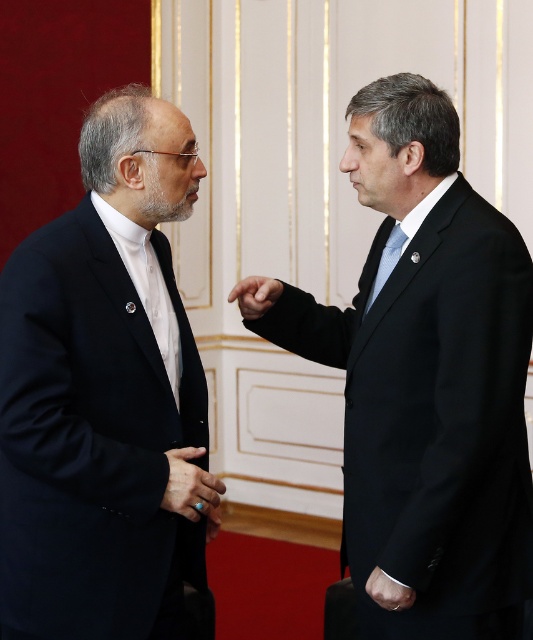
Question: Does smooth skin hand at center have a smaller size compared to blue silk tie at right?

Choices:
 (A) yes
 (B) no

Answer: (B)

Question: Is matte black suit at left behind matte black hand at center?

Choices:
 (A) yes
 (B) no

Answer: (B)

Question: Which point is closer to the camera?

Choices:
 (A) blue silk tie at right
 (B) matte black suit at left
 (C) matte black hand at center
 (D) black matte suit at right

Answer: (B)

Question: Does matte black hand at center have a smaller size compared to smooth skin hand at center?

Choices:
 (A) yes
 (B) no

Answer: (B)

Question: Which object is the farthest from the black matte suit at right?

Choices:
 (A) smooth skin hand at center
 (B) leather glove at lower right
 (C) matte black suit at left
 (D) matte black hand at center

Answer: (B)

Question: Which point is closer to the camera?

Choices:
 (A) matte black suit at left
 (B) matte black hand at center
 (C) smooth skin hand at center
 (D) black matte suit at right

Answer: (A)